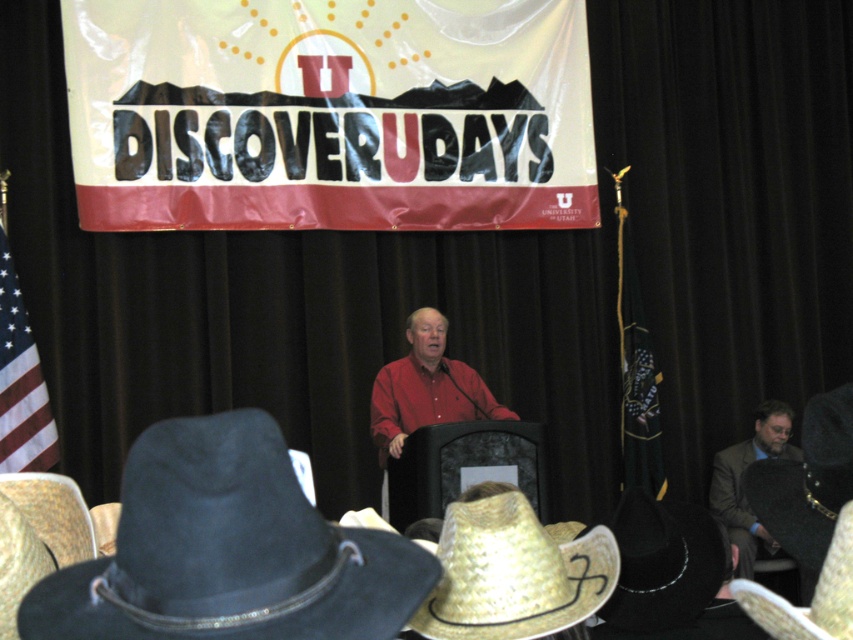
Is red fabric flag at left to the right of straw textured cowboy hat at lower right from the viewer's perspective?

In fact, red fabric flag at left is to the left of straw textured cowboy hat at lower right.

Can you confirm if red fabric flag at left is positioned above straw textured cowboy hat at lower right?

Yes, red fabric flag at left is above straw textured cowboy hat at lower right.

Is point (28, 353) behind point (845, 630)?

Yes, point (28, 353) is behind point (845, 630).

Find the location of a particular element. The width and height of the screenshot is (853, 640). red fabric flag at left is located at coordinates (20, 381).

Which of these two, red cotton shirt at center or straw textured cowboy hat at lower right, stands shorter?

straw textured cowboy hat at lower right is shorter.

Is red cotton shirt at center to the left of straw textured cowboy hat at lower right from the viewer's perspective?

Yes, red cotton shirt at center is to the left of straw textured cowboy hat at lower right.

Describe the element at coordinates (426, 387) in the screenshot. I see `red cotton shirt at center` at that location.

Locate an element on the screen. red cotton shirt at center is located at coordinates (426, 387).

Who is positioned more to the right, strawmaterial/texturecowboy hat at lower center or straw textured cowboy hat at lower right?

straw textured cowboy hat at lower right

Between strawmaterial/texturecowboy hat at lower center and straw textured cowboy hat at lower right, which one has more height?

Standing taller between the two is straw textured cowboy hat at lower right.

Find the location of a particular element. strawmaterial/texturecowboy hat at lower center is located at coordinates (514, 573).